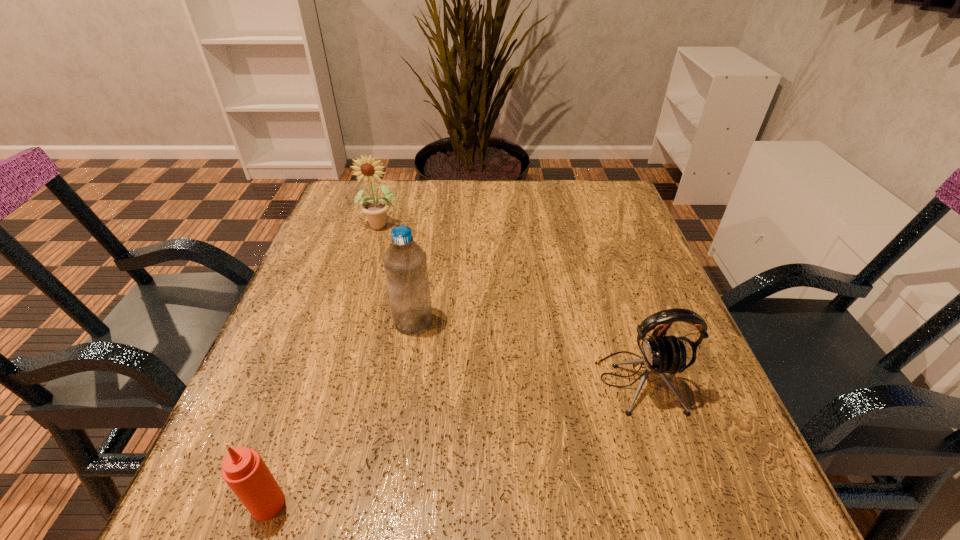
Find the location of a particular element. water bottle is located at coordinates (405, 263).

Identify the location of the third object from left to right. This screenshot has height=540, width=960. (405, 263).

Locate an element on the screen. Image resolution: width=960 pixels, height=540 pixels. sunflower is located at coordinates (367, 169).

Locate an element on the screen. The width and height of the screenshot is (960, 540). earphone is located at coordinates (660, 355).

In order to click on the rightmost object in this screenshot , I will do `click(660, 355)`.

At what (x,y) coordinates should I click in order to perform the action: click on the shortest object. Please return your answer as a coordinate pair (x, y). The image size is (960, 540). Looking at the image, I should click on (243, 469).

Where is `the nearest object`? This screenshot has height=540, width=960. the nearest object is located at coordinates (243, 469).

What are the coordinates of `vacant space located 0.380m on the back of the water bottle` in the screenshot? It's located at (432, 205).

Identify the location of free location located 0.300m on the front-facing side of the farthest object. (350, 328).

In order to click on free space located 0.220m on the back of the rightmost object in this screenshot , I will do `click(603, 272)`.